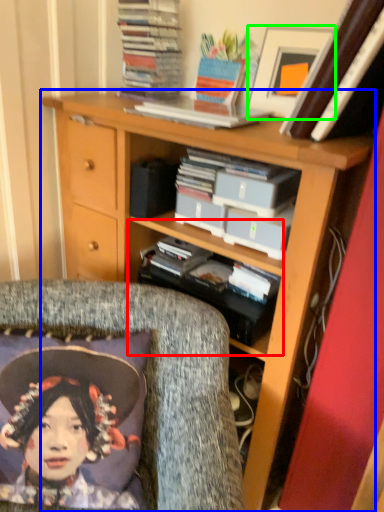
Question: Which is farther away from shelf (highlighted by a red box)? bookcase (highlighted by a blue box) or picture frame (highlighted by a green box)?

Choices:
 (A) bookcase
 (B) picture frame

Answer: (B)